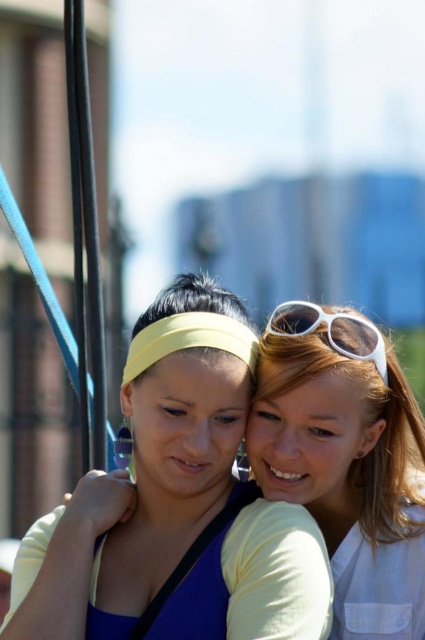
Does white matte sunglasses at upper right appear on the left side of white plastic sunglasses at upper right?

No, white matte sunglasses at upper right is not to the left of white plastic sunglasses at upper right.

Which is above, white matte sunglasses at upper right or white plastic sunglasses at upper right?

white plastic sunglasses at upper right is higher up.

Who is more forward, [316,396] or [357,348]?

Point [316,396]

Find the location of `white matte sunglasses at upper right`. white matte sunglasses at upper right is located at coordinates (348, 470).

Is matte yellow headband at center to the left of white matte sunglasses at upper right from the viewer's perspective?

Indeed, matte yellow headband at center is positioned on the left side of white matte sunglasses at upper right.

Based on the photo, does matte yellow headband at center have a lesser width compared to white matte sunglasses at upper right?

Incorrect, matte yellow headband at center's width is not less than white matte sunglasses at upper right's.

Between point (192, 536) and point (339, 460), which one is positioned in front?

Point (192, 536) is more forward.

Find the location of a particular element. This screenshot has height=640, width=425. matte yellow headband at center is located at coordinates (144, 474).

Is matte yellow headband at center bigger than white plastic sunglasses at upper right?

Yes, matte yellow headband at center is bigger than white plastic sunglasses at upper right.

Is matte yellow headband at center to the left of white plastic sunglasses at upper right from the viewer's perspective?

Indeed, matte yellow headband at center is positioned on the left side of white plastic sunglasses at upper right.

I want to click on matte yellow headband at center, so click(144, 474).